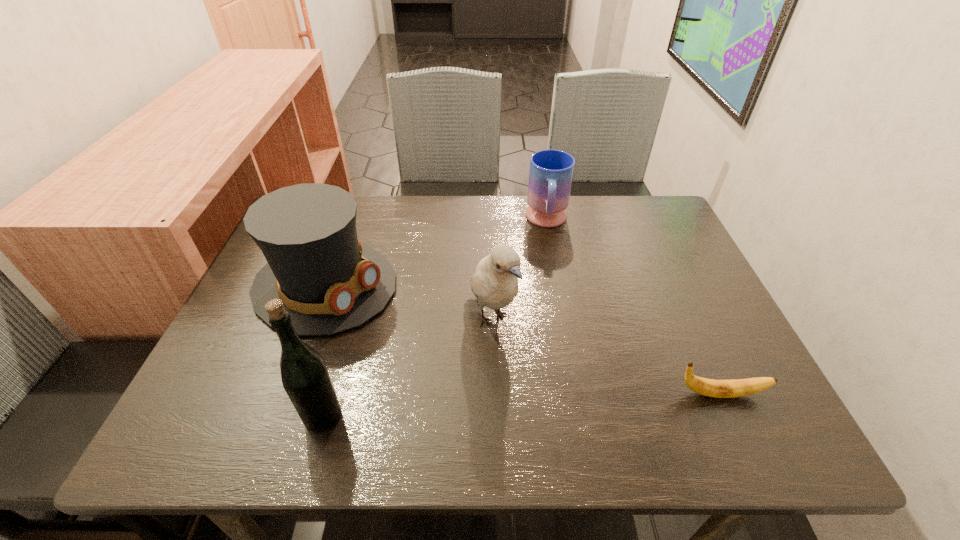
Identify the location of object identified as the second closest to the fourth tallest object. Image resolution: width=960 pixels, height=540 pixels. (330, 283).

Locate an element on the screen. Image resolution: width=960 pixels, height=540 pixels. the third closest object relative to the banana is located at coordinates (330, 283).

Where is `vacant space that satisfies the following two spatial constraints: 1. on the front side of the tallest object; 2. on the right side of the dress hat`? This screenshot has height=540, width=960. vacant space that satisfies the following two spatial constraints: 1. on the front side of the tallest object; 2. on the right side of the dress hat is located at coordinates (276, 416).

Image resolution: width=960 pixels, height=540 pixels. I want to click on free location that satisfies the following two spatial constraints: 1. on the back side of the tallest object; 2. on the right side of the second object from right to left, so click(x=378, y=221).

The image size is (960, 540). Find the location of `free region that satisfies the following two spatial constraints: 1. on the front side of the rightmost object; 2. on the peel of the third object from left to right from the top`. free region that satisfies the following two spatial constraints: 1. on the front side of the rightmost object; 2. on the peel of the third object from left to right from the top is located at coordinates (492, 394).

This screenshot has height=540, width=960. What are the coordinates of `vacant space that satisfies the following two spatial constraints: 1. on the front side of the shortest object; 2. on the peel of the dress hat from the top` in the screenshot? It's located at (285, 394).

Where is `free space that satisfies the following two spatial constraints: 1. on the front side of the shortest object; 2. on the peel of the bird from the top`? The width and height of the screenshot is (960, 540). free space that satisfies the following two spatial constraints: 1. on the front side of the shortest object; 2. on the peel of the bird from the top is located at coordinates (492, 394).

The height and width of the screenshot is (540, 960). In order to click on blank space that satisfies the following two spatial constraints: 1. on the front side of the bird; 2. on the left side of the dress hat in this screenshot , I will do `click(313, 319)`.

Find the location of a particular element. Image resolution: width=960 pixels, height=540 pixels. free spot that satisfies the following two spatial constraints: 1. on the front side of the farthest object; 2. on the peel of the rightmost object from the top is located at coordinates (580, 394).